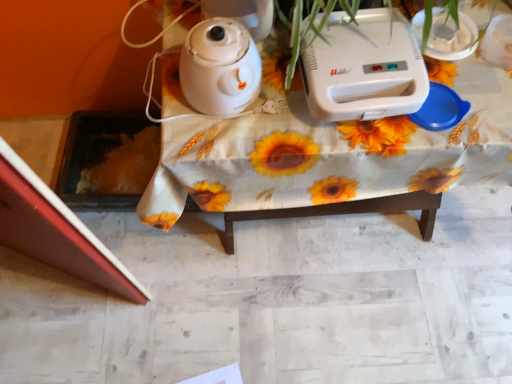
This screenshot has width=512, height=384. What are the coordinates of `free location in front of white plastic toaster at upper center` in the screenshot? It's located at (357, 145).